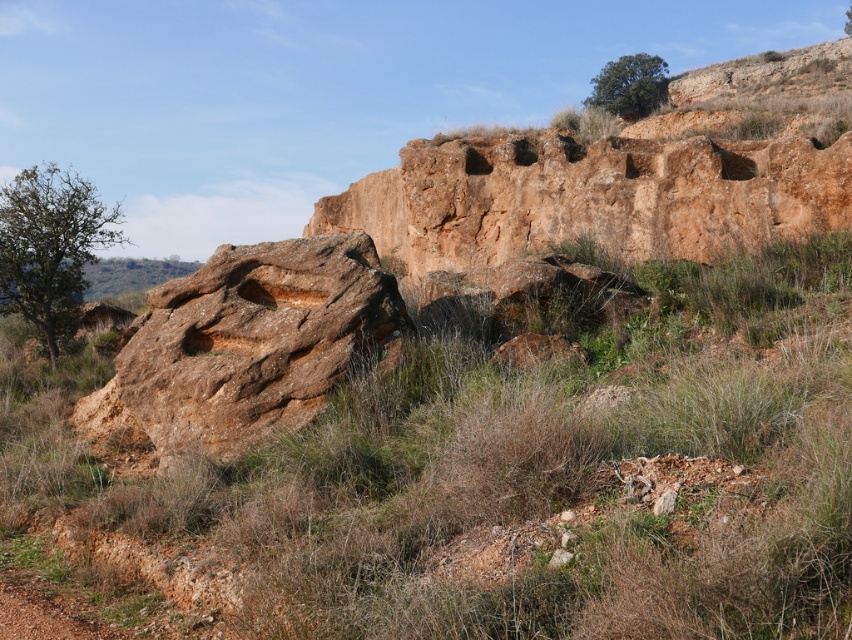
Question: Which of these objects is positioned closest to the brown dirt track at lower left?

Choices:
 (A) brown rock at center
 (B) brown rough rock at center

Answer: (B)

Question: Among these objects, which one is nearest to the camera?

Choices:
 (A) brown rock at center
 (B) brown rough rock at center
 (C) brown dirt track at lower left

Answer: (A)

Question: Does brown rock at center appear under brown rough rock at center?

Choices:
 (A) no
 (B) yes

Answer: (B)

Question: Estimate the real-world distances between objects in this image. Which object is closer to the brown dirt track at lower left?

Choices:
 (A) brown rough rock at center
 (B) brown rock at center

Answer: (A)

Question: Can you confirm if brown rock at center is thinner than brown dirt track at lower left?

Choices:
 (A) yes
 (B) no

Answer: (A)

Question: From the image, what is the correct spatial relationship of brown rough rock at center in relation to brown dirt track at lower left?

Choices:
 (A) above
 (B) below

Answer: (A)